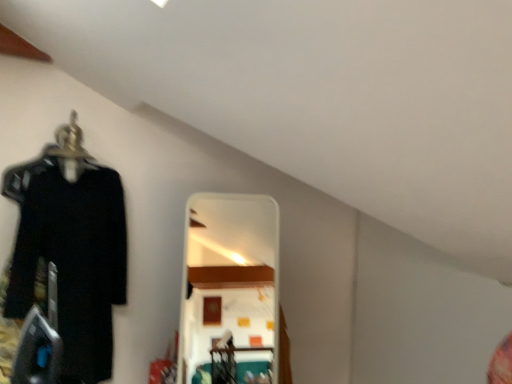
Where is `metallic silver hanger at left`? metallic silver hanger at left is located at coordinates (69, 141).

What do you see at coordinates (69, 141) in the screenshot? I see `metallic silver hanger at left` at bounding box center [69, 141].

Find the location of a particular element. This screenshot has height=384, width=512. black matte shirt at left is located at coordinates (70, 256).

What do you see at coordinates (70, 256) in the screenshot?
I see `black matte shirt at left` at bounding box center [70, 256].

You are a GUI agent. You are given a task and a screenshot of the screen. Output one action in this format:
    pyautogui.click(x=<x>, y=<y>)
    Task: Click on the metallic silver hanger at left
    This screenshot has height=384, width=512.
    Given the screenshot: What is the action you would take?
    click(x=69, y=141)

Is metallic silver hanger at left to the right of black matte shirt at left from the viewer's perspective?

No.

Is metallic silver hanger at left in front of or behind black matte shirt at left in the image?

Clearly, metallic silver hanger at left is behind black matte shirt at left.

Is point (72, 111) positioned after point (102, 276)?

No.

From the image's perspective, would you say metallic silver hanger at left is shown under black matte shirt at left?

Actually, metallic silver hanger at left appears above black matte shirt at left in the image.

In the scene shown: From a real-world perspective, between metallic silver hanger at left and black matte shirt at left, who is vertically lower?

From a 3D spatial view, black matte shirt at left is below.

Considering the sizes of objects metallic silver hanger at left and black matte shirt at left in the image provided, who is wider, metallic silver hanger at left or black matte shirt at left?

Wider between the two is metallic silver hanger at left.

Considering the relative sizes of metallic silver hanger at left and black matte shirt at left in the image provided, is metallic silver hanger at left taller than black matte shirt at left?

No, metallic silver hanger at left is not taller than black matte shirt at left.

Considering the sizes of objects metallic silver hanger at left and black matte shirt at left in the image provided, who is bigger, metallic silver hanger at left or black matte shirt at left?

With larger size is black matte shirt at left.

Is metallic silver hanger at left completely or partially outside of black matte shirt at left?

That's correct, metallic silver hanger at left is outside of black matte shirt at left.

Would you say metallic silver hanger at left is a long distance from black matte shirt at left?

metallic silver hanger at left is actually quite close to black matte shirt at left.

Does metallic silver hanger at left turn towards black matte shirt at left?

No, metallic silver hanger at left is not oriented towards black matte shirt at left.

What's the angular difference between metallic silver hanger at left and black matte shirt at left's facing directions?

There is a 2.51-degree angle between the facing directions of metallic silver hanger at left and black matte shirt at left.

Measure the distance from metallic silver hanger at left to black matte shirt at left.

metallic silver hanger at left is 15.00 inches away from black matte shirt at left.

At what (x,y) coordinates should I click in order to perform the action: click on hanger that is above the black matte shirt at left (from a real-world perspective). Please return your answer as a coordinate pair (x, y). Image resolution: width=512 pixels, height=384 pixels. Looking at the image, I should click on 69,141.

Considering the relative positions of black matte shirt at left and metallic silver hanger at left in the image provided, is black matte shirt at left to the right of metallic silver hanger at left from the viewer's perspective?

Yes, black matte shirt at left is to the right of metallic silver hanger at left.

Which object is more forward, black matte shirt at left or metallic silver hanger at left?

black matte shirt at left is closer to the camera.

Does point (74, 370) come in front of point (92, 158)?

Yes, it is in front of point (92, 158).

From the image's perspective, which one is positioned higher, black matte shirt at left or metallic silver hanger at left?

metallic silver hanger at left, from the image's perspective.

From a real-world perspective, is black matte shirt at left under metallic silver hanger at left?

Yes, from a real-world perspective, black matte shirt at left is under metallic silver hanger at left.

Between black matte shirt at left and metallic silver hanger at left, which one has larger width?

Wider between the two is metallic silver hanger at left.

In terms of height, does black matte shirt at left look taller or shorter compared to metallic silver hanger at left?

In the image, black matte shirt at left appears to be taller than metallic silver hanger at left.

Does black matte shirt at left have a larger size compared to metallic silver hanger at left?

Yes, black matte shirt at left is bigger than metallic silver hanger at left.

Is black matte shirt at left completely or partially outside of metallic silver hanger at left?

Yes, black matte shirt at left is not within metallic silver hanger at left.

Are black matte shirt at left and metallic silver hanger at left located far from each other?

No.

Is black matte shirt at left facing away from metallic silver hanger at left?

black matte shirt at left is not turned away from metallic silver hanger at left.

What's the angular difference between black matte shirt at left and metallic silver hanger at left's facing directions?

There is a 2.51-degree angle between the facing directions of black matte shirt at left and metallic silver hanger at left.

Where is `hanger on the left of black matte shirt at left`? This screenshot has height=384, width=512. hanger on the left of black matte shirt at left is located at coordinates (69, 141).

Identify the location of hanger that appears above the black matte shirt at left (from a real-world perspective). (69, 141).

Where is `hanger above the black matte shirt at left (from the image's perspective)`? The width and height of the screenshot is (512, 384). hanger above the black matte shirt at left (from the image's perspective) is located at coordinates (69, 141).